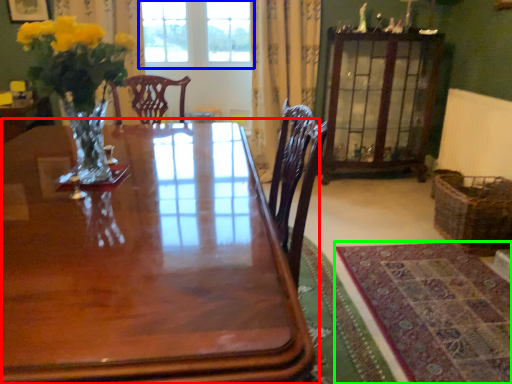
Question: Which is farther away from table (highlighted by a red box)? window (highlighted by a blue box) or mat (highlighted by a green box)?

Choices:
 (A) window
 (B) mat

Answer: (A)